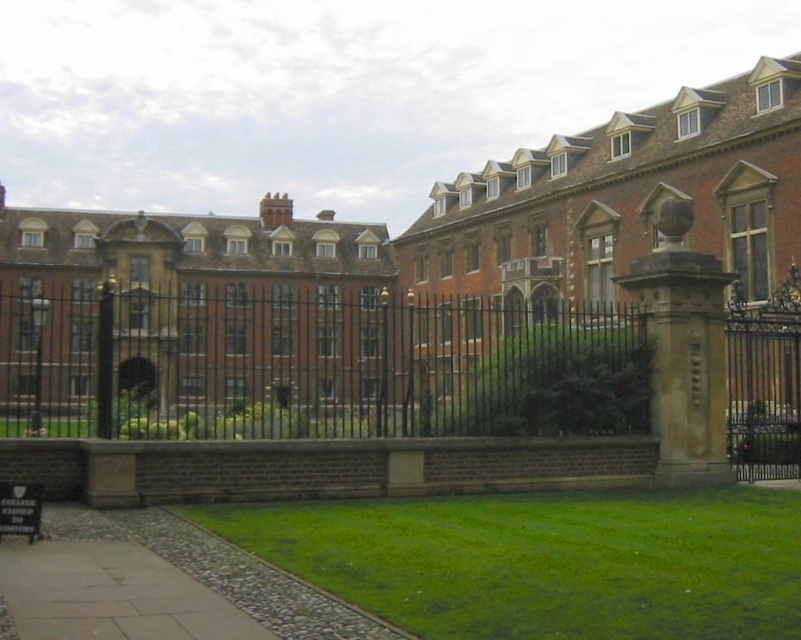
Question: Is brick building at center bigger than green grass at lower center?

Choices:
 (A) yes
 (B) no

Answer: (A)

Question: From the image, what is the correct spatial relationship of brick building at center in relation to green grass at lower center?

Choices:
 (A) right
 (B) left

Answer: (B)

Question: Is brick building at center wider than black wrought iron fence at center?

Choices:
 (A) yes
 (B) no

Answer: (A)

Question: Which point appears closest to the camera in this image?

Choices:
 (A) (765, 564)
 (B) (427, 355)
 (C) (797, 116)

Answer: (A)

Question: Which point appears farthest from the camera in this image?

Choices:
 (A) (405, 435)
 (B) (566, 356)
 (C) (719, 627)

Answer: (B)

Question: Which point is closer to the camera?

Choices:
 (A) [x=549, y=552]
 (B) [x=302, y=401]
 (C) [x=172, y=436]

Answer: (A)